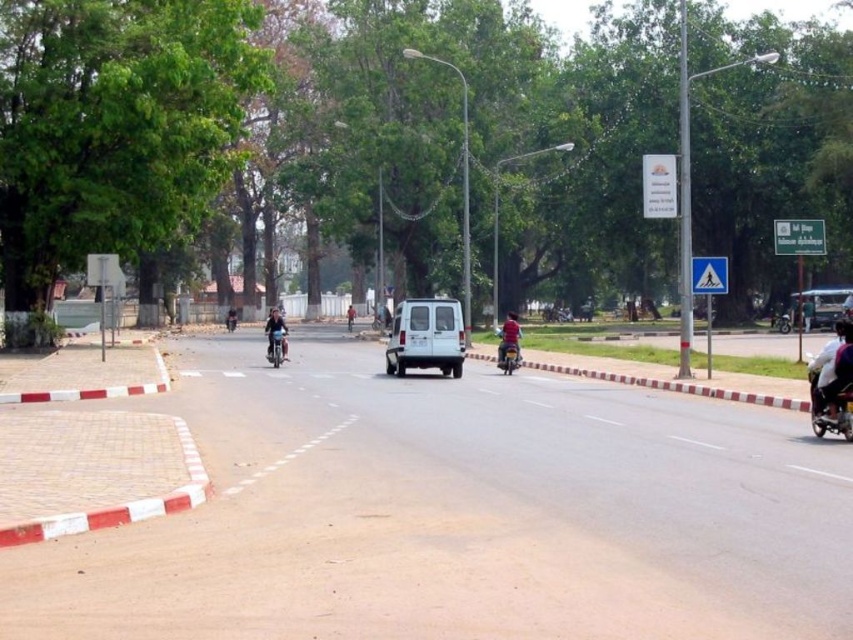
Question: Which of the following is the closest to the observer?

Choices:
 (A) red glossy motorcycle at center
 (B) red fabric helmet at center

Answer: (A)

Question: Does white fabric shirt at right have a greater width compared to metallic silver van at center?

Choices:
 (A) yes
 (B) no

Answer: (A)

Question: Is metallic silver van at center to the right of red fabric helmet at center from the viewer's perspective?

Choices:
 (A) no
 (B) yes

Answer: (B)

Question: Which is nearer to the white matte van at center?

Choices:
 (A) metallic silver van at center
 (B) dark blue motorcycle at center

Answer: (B)

Question: Can you confirm if dark blue motorcycle at center is thinner than red fabric helmet at center?

Choices:
 (A) yes
 (B) no

Answer: (B)

Question: Which of the following is the farthest from the observer?

Choices:
 (A) (349, 308)
 (B) (827, 317)
 (C) (408, 332)
 (D) (277, 317)

Answer: (A)